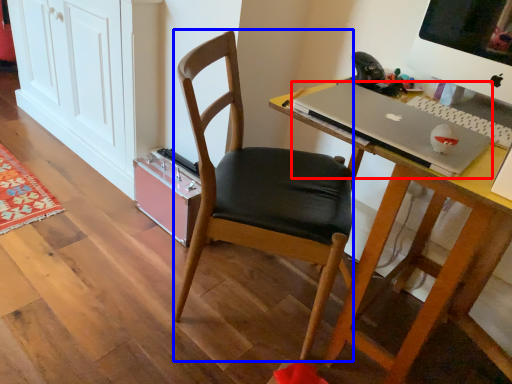
Question: Which of the following is the farthest to the observer, laptop (highlighted by a red box) or chair (highlighted by a blue box)?

Choices:
 (A) laptop
 (B) chair

Answer: (B)